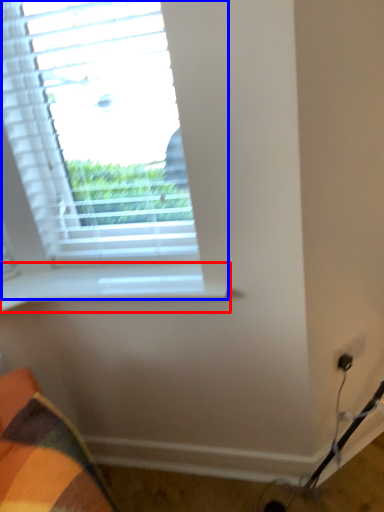
Question: Which point is further to the camera, window sill (highlighted by a red box) or window (highlighted by a blue box)?

Choices:
 (A) window sill
 (B) window

Answer: (A)